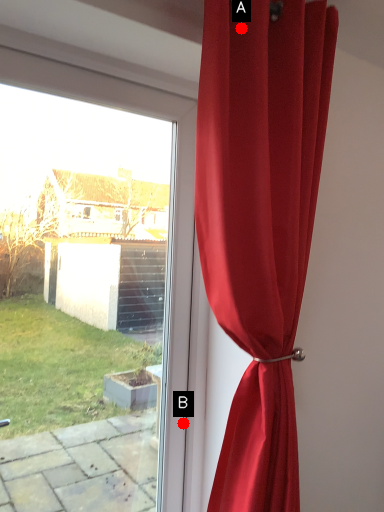
Question: Two points are circled on the image, labeled by A and B beside each circle. Which point appears farthest from the camera in this image?

Choices:
 (A) A is further
 (B) B is further

Answer: (B)